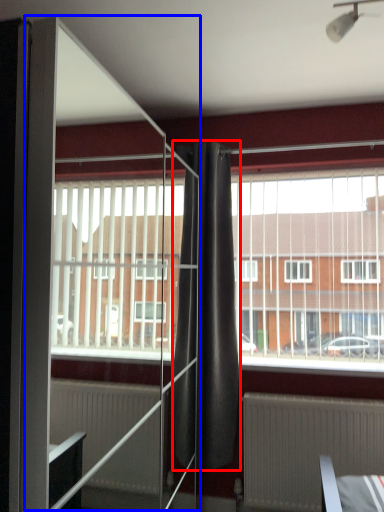
Question: Which of the following is the closest to the observer, curtain (highlighted by a red box) or screen door (highlighted by a blue box)?

Choices:
 (A) curtain
 (B) screen door

Answer: (B)